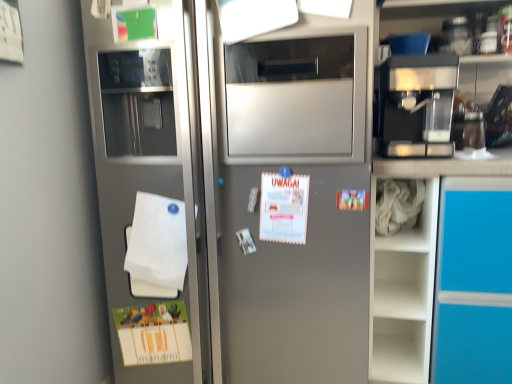
Question: From a real-world perspective, is white matte paper at upper center above or below white fabric at right?

Choices:
 (A) above
 (B) below

Answer: (A)

Question: Considering the relative positions of white matte paper at upper center and white fabric at right in the image provided, is white matte paper at upper center to the left or to the right of white fabric at right?

Choices:
 (A) left
 (B) right

Answer: (A)

Question: Which of these objects is positioned farthest from the white fabric at right?

Choices:
 (A) white matte notepad at lower left
 (B) satin silver refrigerator at left
 (C) metallic espresso machine at upper right
 (D) white matte paper at upper center

Answer: (A)

Question: Which object is positioned farthest from the white matte paper at upper center?

Choices:
 (A) white fabric at right
 (B) metallic espresso machine at upper right
 (C) satin silver refrigerator at left
 (D) white matte notepad at lower left

Answer: (A)